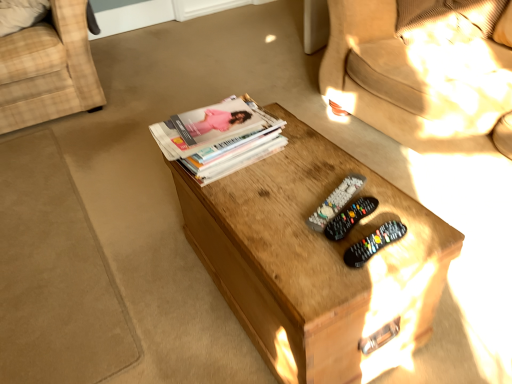
Where is `free space that is in between black plastic remote at center, which is the 3th remote control from front to back, and white glossy magazine stack at center`? free space that is in between black plastic remote at center, which is the 3th remote control from front to back, and white glossy magazine stack at center is located at coordinates (279, 176).